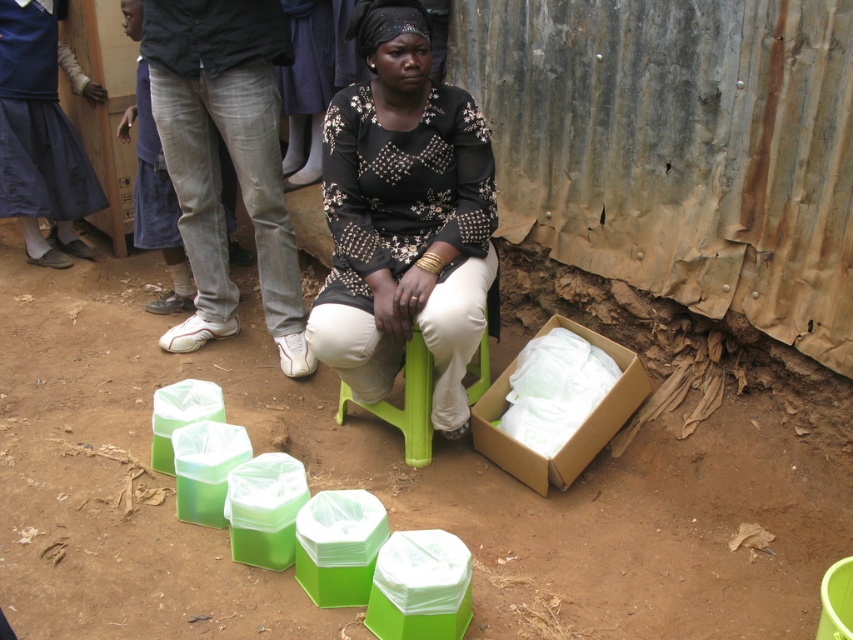
You are organizing items in the scene. You need to move the brown cardboard box at lower right to the left side of the blue fabric skirt at lower left. Is this possible given their current positions?

The blue fabric skirt at lower left is already to the left of the brown cardboard box at lower right, so moving the brown cardboard box at lower right to the left of the blue fabric skirt at lower left would place it in the opposite direction of its current position. This isn not possible without rearranging other items.

You are a delivery person who needs to place a new package on the lowest shelf. The shelf can only hold items that are shorter than the blue fabric skirt at lower left. Can the brown cardboard box at lower right be placed there?

The blue fabric skirt at lower left is taller than the brown cardboard box at lower right. Since the shelf requires items shorter than the skirt, the brown cardboard box at lower right can be placed there as it is shorter.